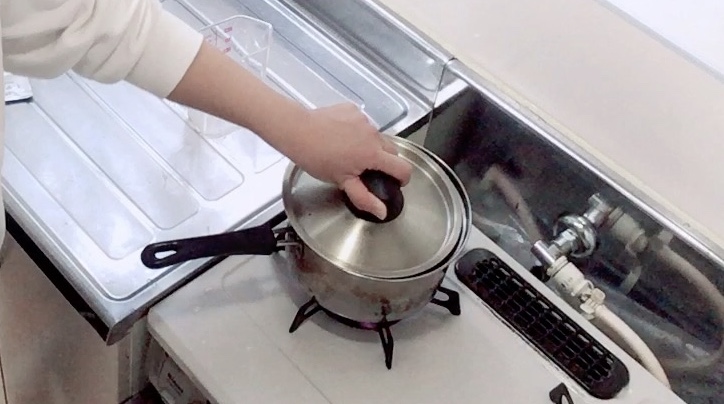
I want to click on counter top, so click(467, 363).